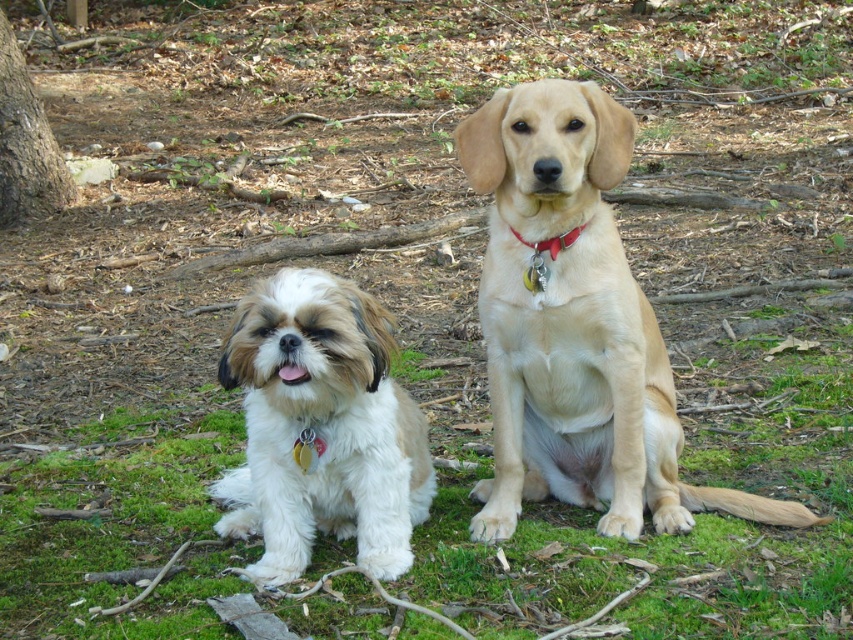
Question: Where is light brown fur at center located in relation to red leather collar at center in the image?

Choices:
 (A) below
 (B) above

Answer: (A)

Question: Which is nearer to the brown rough bark tree at left?

Choices:
 (A) red leather collar at center
 (B) green soft grass at center

Answer: (B)

Question: Is green soft grass at center positioned at the back of brown rough bark tree at left?

Choices:
 (A) no
 (B) yes

Answer: (A)

Question: Among these points, which one is nearest to the camera?

Choices:
 (A) (515, 230)
 (B) (502, 125)
 (C) (103, 625)
 (D) (20, 177)

Answer: (C)

Question: Which point is closer to the camera?

Choices:
 (A) (527, 284)
 (B) (717, 369)

Answer: (A)

Question: Is green soft grass at center positioned in front of red leather collar at center?

Choices:
 (A) no
 (B) yes

Answer: (B)